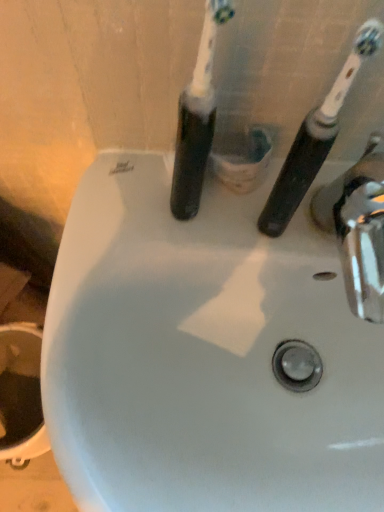
You are a GUI agent. You are given a task and a screenshot of the screen. Output one action in this format:
    pyautogui.click(x=<x>, y=<y>)
    Task: Click on the vacant space to the left of chrome metallic tap at right
    The height and width of the screenshot is (512, 384).
    Given the screenshot: What is the action you would take?
    tap(174, 232)